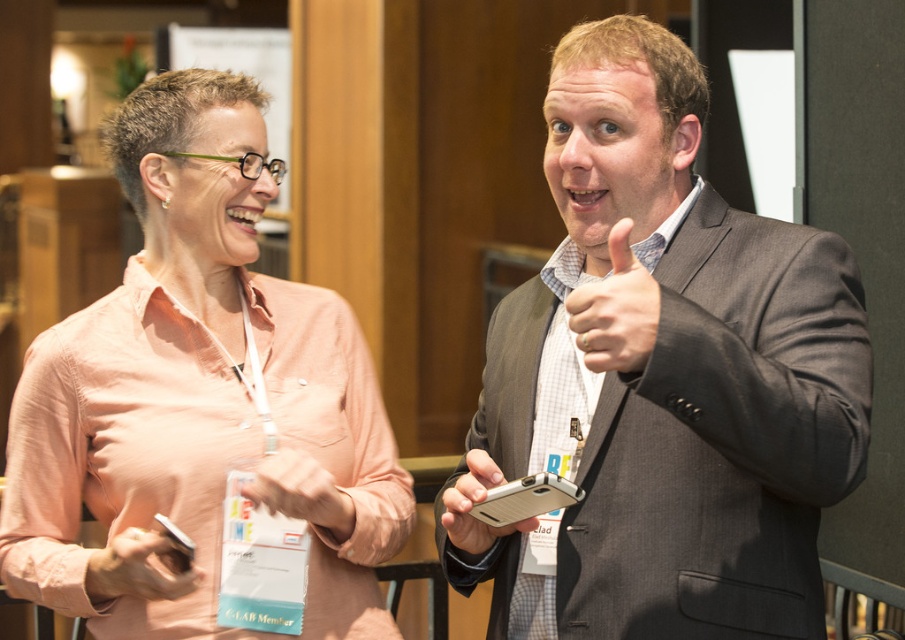
You are an event photographer at the conference. You need to capture a closeup shot of both the matte gray hand at center and the pink fabric hand at center. Which hand should you focus on first if you want to ensure both are in frame without moving the camera?

The matte gray hand at center is positioned on the right side of pink fabric hand at center, so you should focus on the pink fabric hand at center first to ensure both hands are within the frame from left to right.

You are organizing a photo shoot and need to ensure that the matte gray hand at center and the matte black phone at lower left are both visible in the frame. Given their sizes, which object should you prioritize positioning closer to the camera to maintain clarity and detail?

The matte gray hand at center is larger in size than the matte black phone at lower left. To maintain clarity and detail for both objects, prioritize positioning the matte black phone at lower left closer to the camera since smaller objects require closer placement to ensure they are visible and in focus.